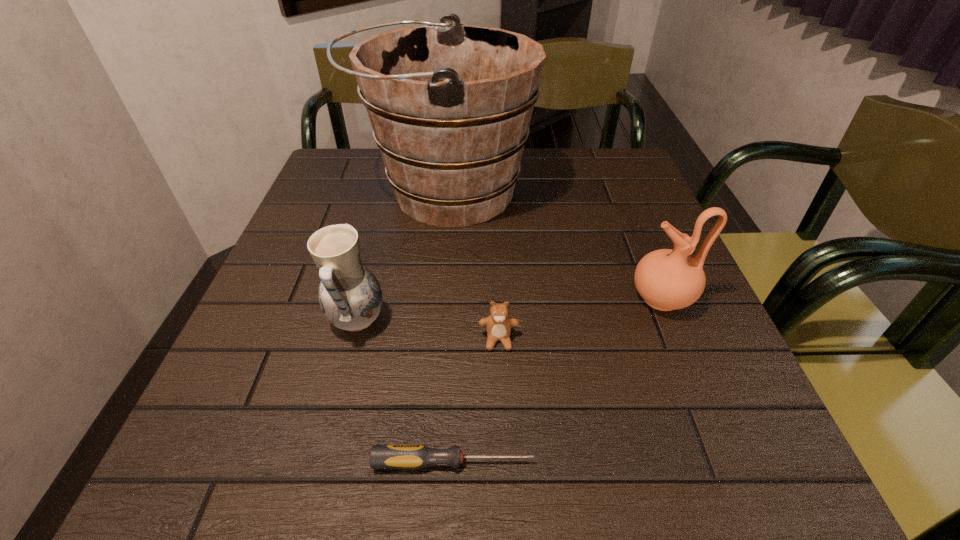
Identify the location of blank region between the teddy bear and the screwdriver. (476, 401).

In order to click on vacant point located between the left pottery and the farthest object in this screenshot , I will do `click(401, 256)`.

You are a GUI agent. You are given a task and a screenshot of the screen. Output one action in this format:
    pyautogui.click(x=<x>, y=<y>)
    Task: Click on the vacant area between the right pottery and the farthest object
    The width and height of the screenshot is (960, 540).
    Given the screenshot: What is the action you would take?
    pyautogui.click(x=553, y=244)

Identify the location of free space that is in between the bucket and the teddy bear. Image resolution: width=960 pixels, height=540 pixels. (471, 265).

Find the location of a particular element. free spot between the farthest object and the left pottery is located at coordinates coord(401,256).

The height and width of the screenshot is (540, 960). I want to click on free spot between the bucket and the left pottery, so click(401, 256).

Select which object is the third closest to the fourth tallest object. Please provide its 2D coordinates. Your answer should be formatted as a tuple, i.e. [(x, y)], where the tuple contains the x and y coordinates of a point satisfying the conditions above.

[(666, 279)]

Locate which object ranks in proximity to the shortest object. Please provide its 2D coordinates. Your answer should be formatted as a tuple, i.e. [(x, y)], where the tuple contains the x and y coordinates of a point satisfying the conditions above.

[(498, 325)]

Where is `free space in the image that satisfies the following two spatial constraints: 1. on the spout of the rightmost object; 2. on the front-facing side of the teddy bear`? free space in the image that satisfies the following two spatial constraints: 1. on the spout of the rightmost object; 2. on the front-facing side of the teddy bear is located at coordinates (679, 340).